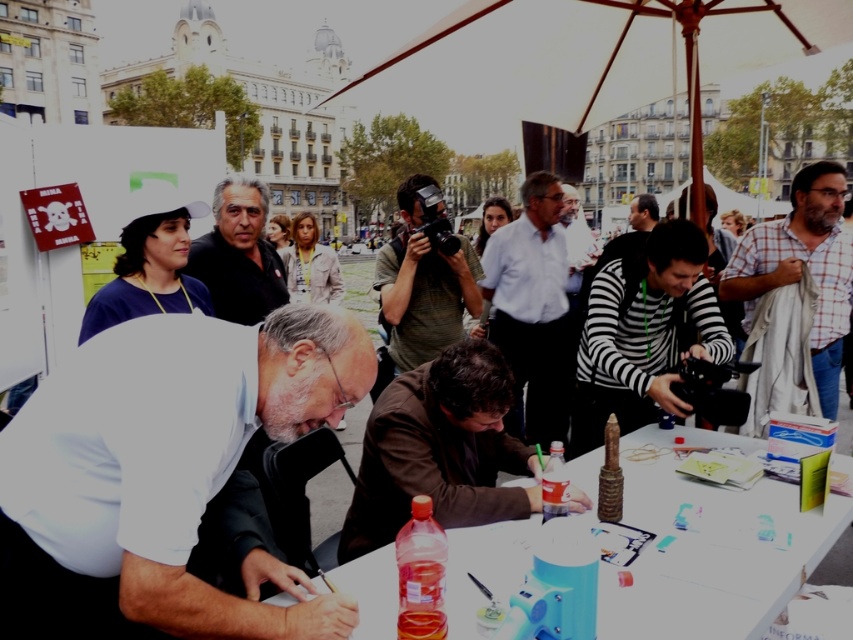
You are setting up a photo shoot in the public square and need to position a light source between the white matte shirt at center and the striped fabric camera at center. Which object should the light be placed closer to if you want to illuminate the wider object more effectively?

The light should be placed closer to the white matte shirt at center because it might be wider than the striped fabric camera at center, allowing better illumination of its broader surface.

You are a photographer at the event and want to capture both the brown leather jacket at center and the matte black shirt at center in a single photo. Your camera has a maximum focus range of 70 feet. Can you fit both subjects within the focus range?

The brown leather jacket at center and matte black shirt at center are 77.81 feet apart from each other, which exceeds the camera focus range of 70 feet. Therefore, both subjects cannot be captured in focus simultaneously.